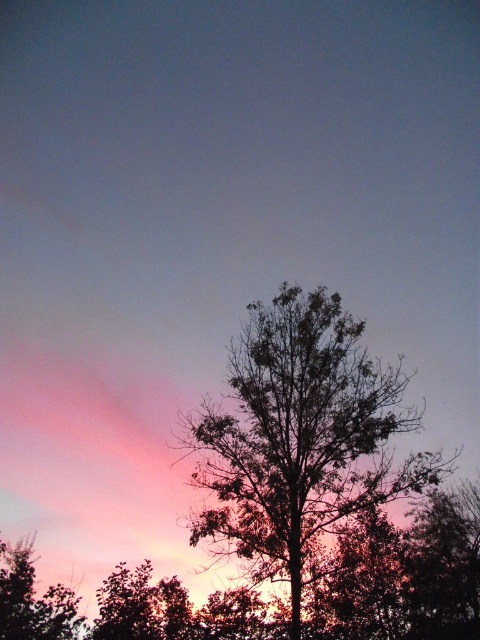
Can you confirm if silhouette leafy tree at center is bigger than green leafy tree at lower left?

Yes, silhouette leafy tree at center is bigger than green leafy tree at lower left.

Which is above, silhouette leafy tree at center or green leafy tree at lower left?

silhouette leafy tree at center is higher up.

Where is `silhouette leafy tree at center`? silhouette leafy tree at center is located at coordinates (300, 440).

Find the location of a particular element. Image resolution: width=480 pixels, height=640 pixels. silhouette leafy tree at center is located at coordinates (300, 440).